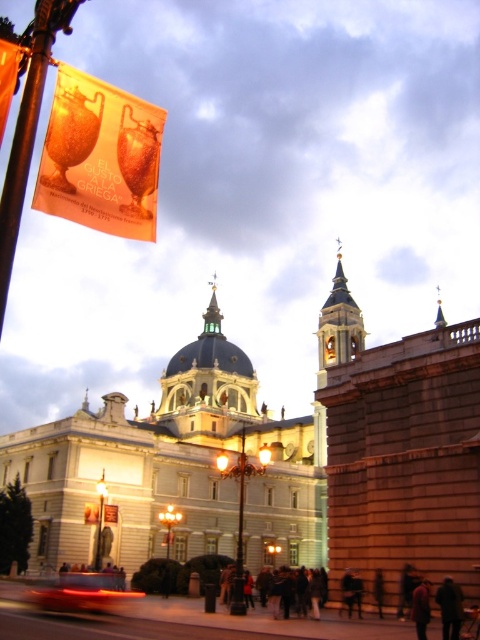
Question: Is golden dome at center below gold textured spire at upper center?

Choices:
 (A) no
 (B) yes

Answer: (B)

Question: Considering the real-world distances, which object is farthest from the gold textured spire at upper center?

Choices:
 (A) blurred red car at lower left
 (B) dark brown leather jacket at lower right
 (C) white stone church at center

Answer: (B)

Question: In this image, where is white stone church at center located relative to dark brown leather coat at lower right?

Choices:
 (A) left
 (B) right

Answer: (A)

Question: Considering the real-world distances, which object is closest to the blurred red car at lower left?

Choices:
 (A) golden dome at center
 (B) dark brown leather jacket at lower right
 (C) gold textured spire at upper center
 (D) white stone church at center

Answer: (B)

Question: Does white stone church at center come in front of golden dome at center?

Choices:
 (A) yes
 (B) no

Answer: (A)

Question: Estimate the real-world distances between objects in this image. Which object is farther from the blurred red car at lower left?

Choices:
 (A) white stone church at center
 (B) golden dome at center
 (C) dark brown leather jacket at lower right
 (D) gold textured spire at upper center

Answer: (B)